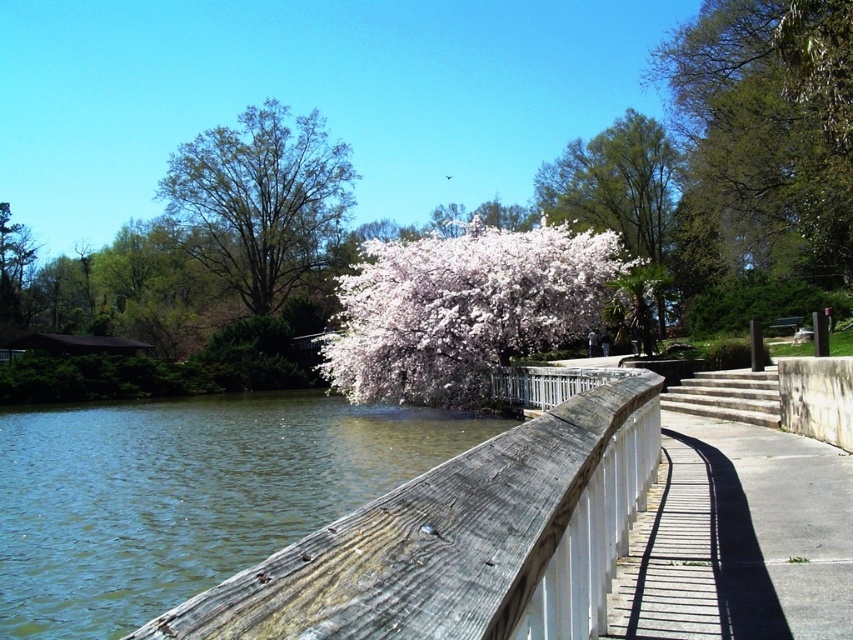
Which is in front, point (631, 378) or point (614, 120)?

Point (631, 378) is more forward.

Who is positioned more to the right, weathered wood rail at center or white blossoming tree at upper center?

From the viewer's perspective, white blossoming tree at upper center appears more on the right side.

At what (x,y) coordinates should I click in order to perform the action: click on weathered wood rail at center. Please return your answer as a coordinate pair (x, y). Image resolution: width=853 pixels, height=640 pixels. Looking at the image, I should click on (466, 534).

Does weathered wood rail at center appear under white concrete pavement at lower right?

Yes.

What do you see at coordinates (466, 534) in the screenshot?
I see `weathered wood rail at center` at bounding box center [466, 534].

Which is behind, point (567, 582) or point (699, 433)?

The point (699, 433) is more distant.

Where is `weathered wood rail at center`? The image size is (853, 640). weathered wood rail at center is located at coordinates (466, 534).

Who is higher up, weathered wood rail at center or green leafy tree at upper left?

green leafy tree at upper left is higher up.

Does weathered wood rail at center appear on the left side of green leafy tree at upper left?

Incorrect, weathered wood rail at center is not on the left side of green leafy tree at upper left.

The height and width of the screenshot is (640, 853). Identify the location of weathered wood rail at center. (466, 534).